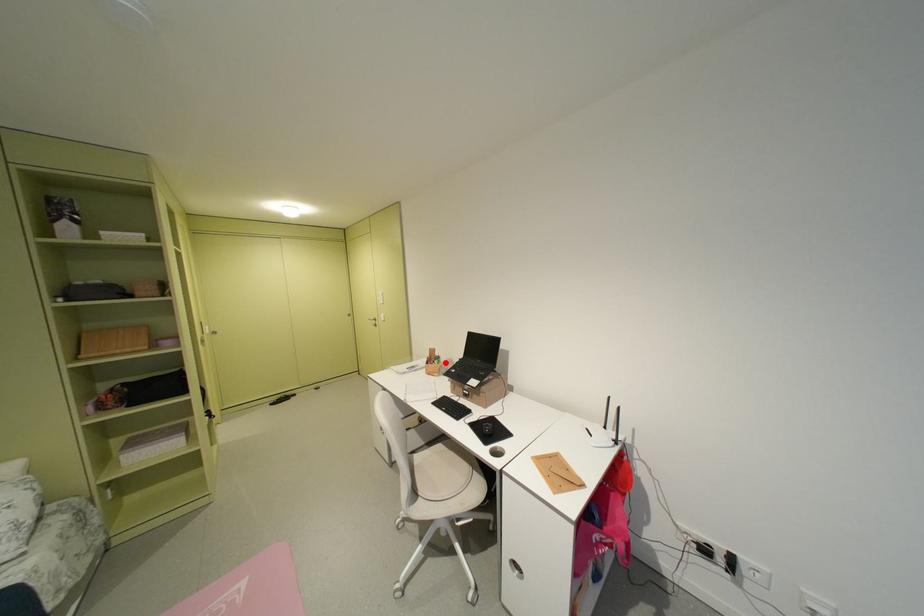
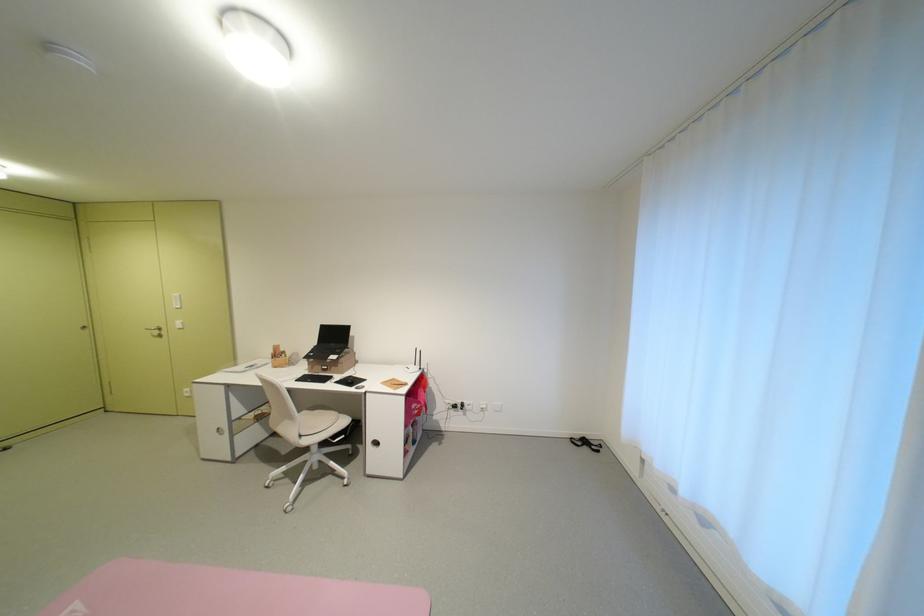
Question: A red point is marked in image1. In image2, is the corresponding 3D point closer to the camera or farther? Reply with the corresponding letter.

Choices:
 (A) The corresponding 3D point is closer.
 (B) The corresponding 3D point is farther.

Answer: (B)